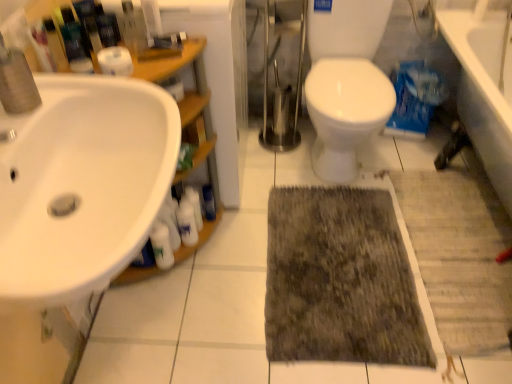
This screenshot has height=384, width=512. I want to click on vacant space to the right of dark gray shaggy rug at center, so click(x=454, y=250).